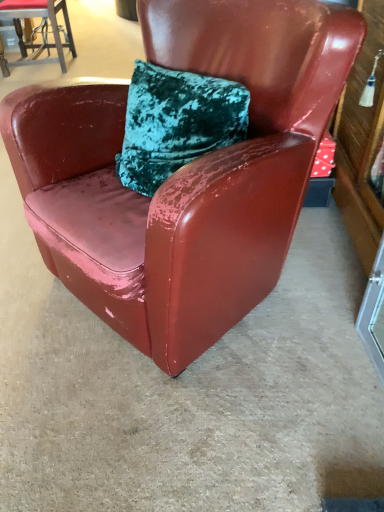
Question: Does point (357, 317) appear closer or farther from the camera than point (59, 192)?

Choices:
 (A) farther
 (B) closer

Answer: (A)

Question: Relative to glossy leather chair at center, the 2th chair when ordered from top to bottom, is transparent glass door at lower right in front or behind?

Choices:
 (A) behind
 (B) front

Answer: (A)

Question: Which of these objects is positioned farthest from the glossy leather chair at upper left, the 2th chair when ordered from bottom to top?

Choices:
 (A) transparent glass door at lower right
 (B) glossy leather chair at center, which is counted as the 1th chair, starting from the right

Answer: (A)

Question: Which is nearer to the glossy leather chair at center, arranged as the 2th chair when viewed from the left?

Choices:
 (A) glossy leather chair at upper left, which is the 1th chair from top to bottom
 (B) transparent glass door at lower right

Answer: (B)